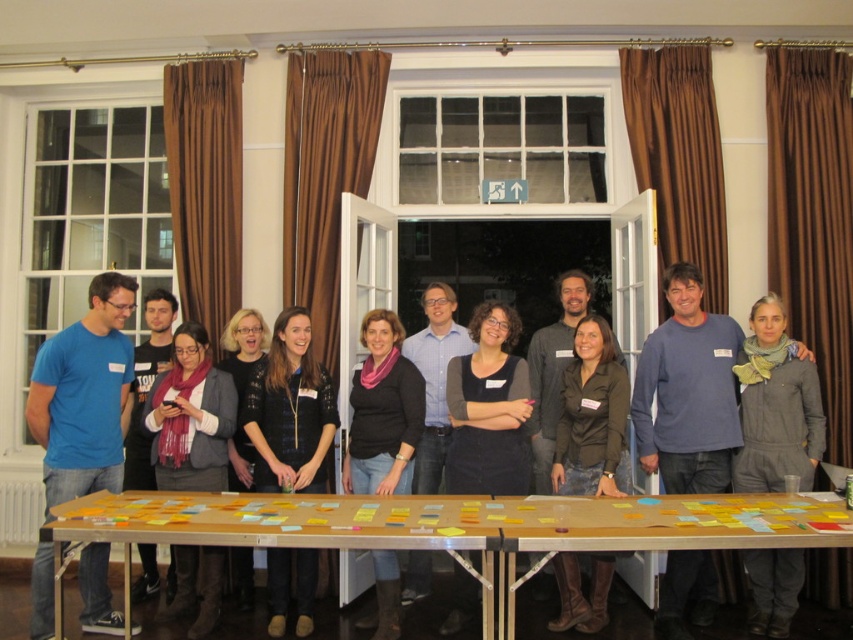
Please look at the coordinates provided in the image. Is the blue cotton shirt at center located at point (131, 561)?

Yes, the blue cotton shirt at center is located at point (131, 561) as marked by the coordinates.

You are a person with a height of 5 feet 6 inches. You are standing at the wooden table at center and want to hand a document to the person wearing the blue cotton shirt at center. Can you reach them without moving from your current position?

The distance between the wooden table at center and the blue cotton shirt at center is 10.90 inches, which is very close. Since you are 5 feet 6 inches tall, you can easily reach across the 10.90 inches to hand the document without needing to move.